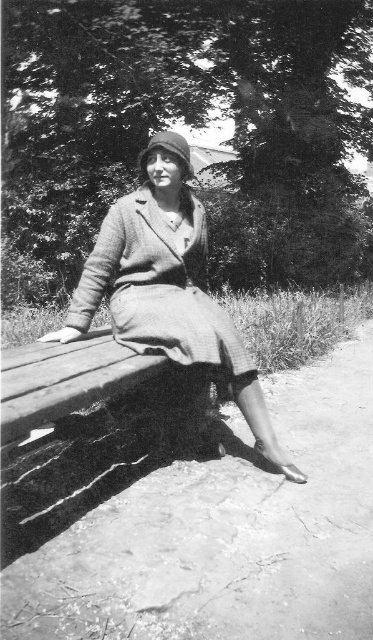
You are an artist trying to sketch this scene. You want to ensure the proportions between the textured wool dress at center and the matte brown hat at upper center are accurate. Which object should you draw first to maintain proper scaling, considering their sizes?

The textured wool dress at center has a smaller size compared to the matte brown hat at upper center. Therefore, you should draw the matte brown hat at upper center first since it is larger and will help establish the scale for the smaller textured wool dress at center.

You are standing in the park and see the coarse woolen coat at center. Where exactly is it located in terms of coordinates?

The coarse woolen coat at center is located at coordinates point (167, 292).

You are standing in a park and want to take a photo of the point at coordinates (232, 388). If your camera has a maximum focus range of 3 meters, will you need to move closer to focus on that point?

The distance of point (232, 388) from the viewer is 3.48 meters, so you need to move closer to focus on that point since it is beyond the camera maximum focus range of 3 meters.